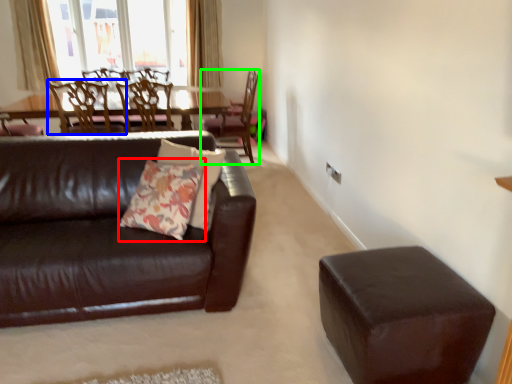
Question: Based on their relative distances, which object is nearer to throw pillow (highlighted by a red box)? Choose from chair (highlighted by a blue box) and chair (highlighted by a green box).

Choices:
 (A) chair
 (B) chair

Answer: (A)